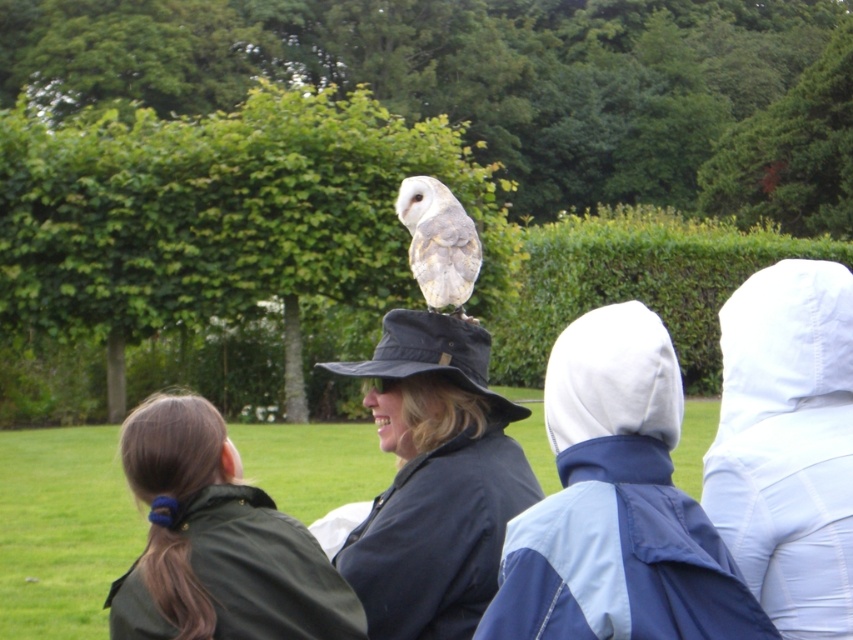
Based on the photo, how distant is green leafy hedge at upper center from dark brown hair at lower left?

green leafy hedge at upper center and dark brown hair at lower left are 4.15 meters apart from each other.

I want to click on green leafy hedge at upper center, so [x=223, y=216].

Is green leafy hedge at upper center further to the viewer compared to dark green jacket at lower left?

Yes, it is.

Is green leafy hedge at upper center above dark green jacket at lower left?

Indeed, green leafy hedge at upper center is positioned over dark green jacket at lower left.

Describe the element at coordinates (223, 216) in the screenshot. The image size is (853, 640). I see `green leafy hedge at upper center` at that location.

Identify the location of green leafy hedge at upper center. (223, 216).

Does dark brown hair at lower left have a smaller size compared to white feathered owl at center?

Actually, dark brown hair at lower left might be larger than white feathered owl at center.

Does dark brown hair at lower left have a greater width compared to white feathered owl at center?

Yes, dark brown hair at lower left is wider than white feathered owl at center.

Does point (178, 484) come behind point (416, 198)?

No, (178, 484) is closer to viewer.

Identify the location of dark brown hair at lower left. (177, 448).